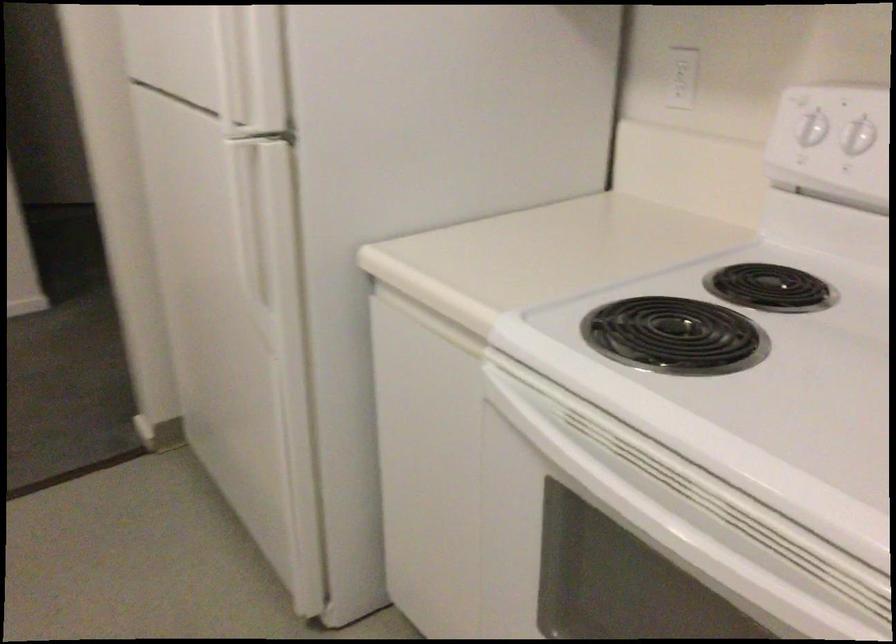
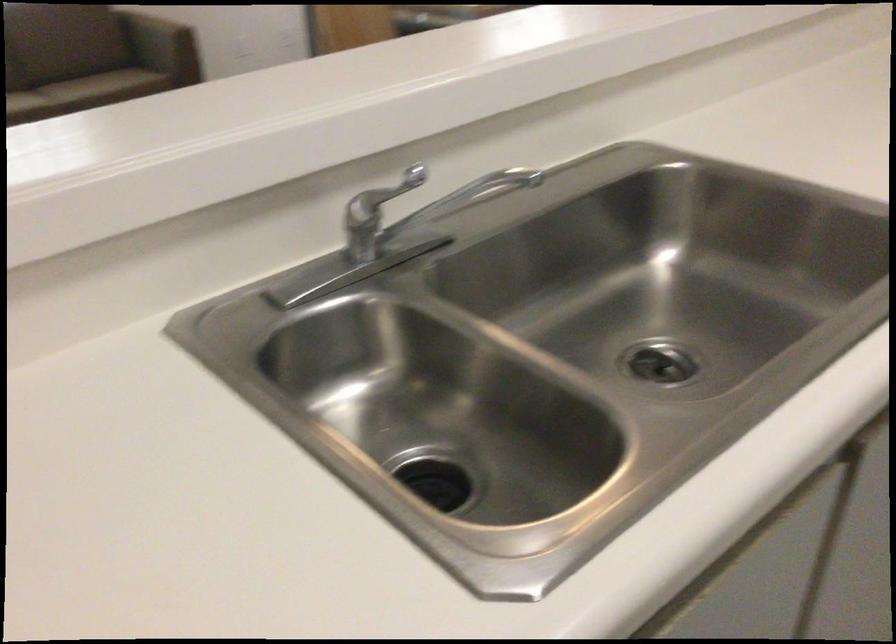
The first image is from the beginning of the video and the second image is from the end. How did the camera likely rotate when shooting the video?

The camera's rotation is toward left-down.